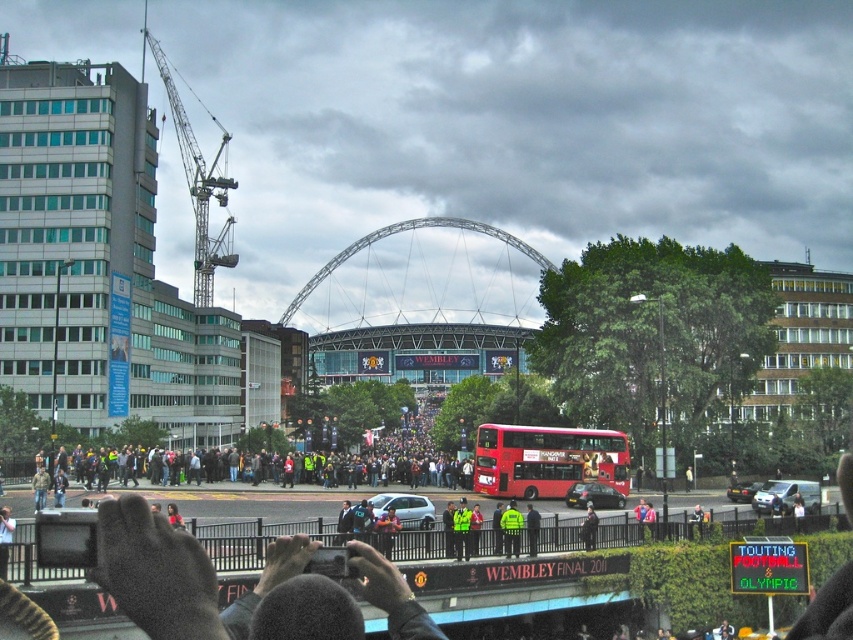
You are a photographer trying to capture a wide shot of the crowd in front of Wembley Stadium. You notice two items of clothing at the center of your frame. Which one, the neon green uniform at center or the high visibility jacket at center, would appear wider in the photo?

The neon green uniform at center would appear wider in the photo because its width is larger than that of the high visibility jacket at center.

You are standing at the point labeled as point (593, 496) in the image. What object are you facing directly?

The point (593, 496) corresponds to the metallic silver car at center, so you are facing directly the metallic silver car at center.